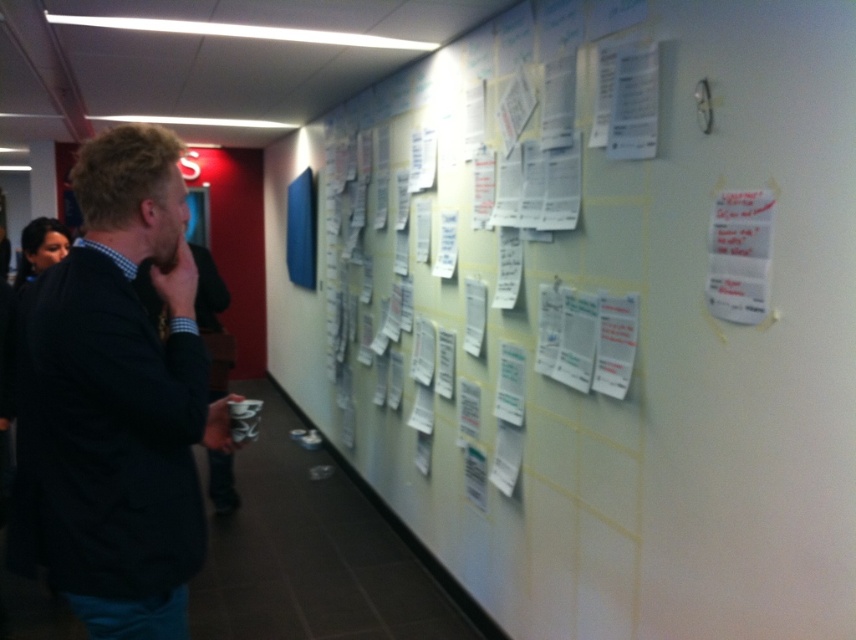
You are a delivery person standing in the hallway and need to place a small package between the white paper at upper center and the dark blue sweater at left. Can you fit the package in the space between them if the package is 1.5 meters long?

The space between the white paper at upper center and the dark blue sweater at left is 1.45 meters, which is shorter than the 1.5 meter package. The package will not fit in the space between them.

Based on the photo, you are standing in the hallway and want to move from point A to point B. Point A is at coordinates point (435,400) and point B is at point (175,195). Which point should you start at to be closer to the wall?

Point (175,195) is closer to the wall because it is further away from the viewer compared to point (435,400), which is closer to the viewer.